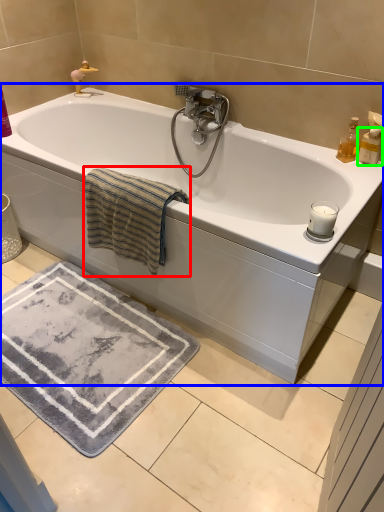
Question: Considering the real-world distances, which object is closest to bath towel (highlighted by a red box)? bathtub (highlighted by a blue box) or toiletry (highlighted by a green box).

Choices:
 (A) bathtub
 (B) toiletry

Answer: (A)